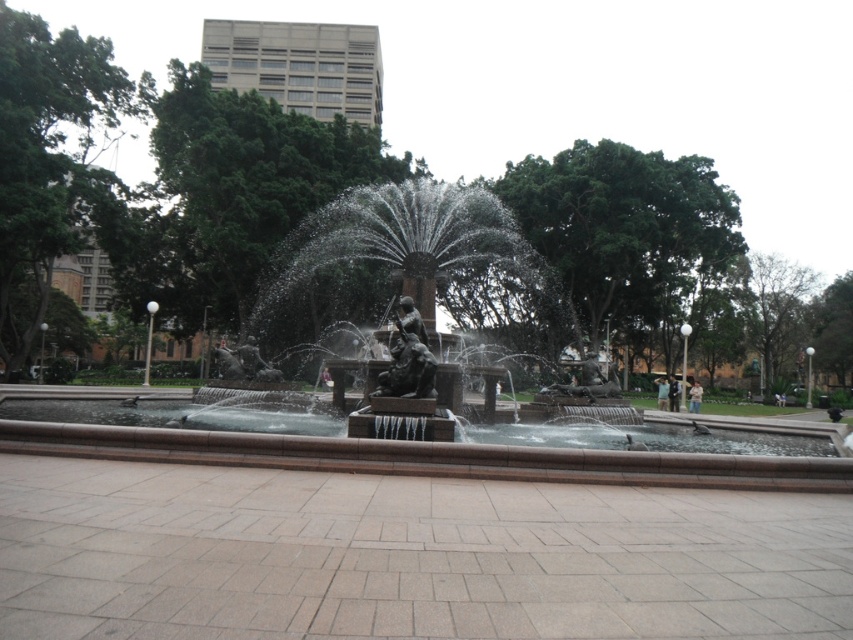
The height and width of the screenshot is (640, 853). What do you see at coordinates (422, 452) in the screenshot?
I see `bronze statue fountain at center` at bounding box center [422, 452].

Between bronze statue fountain at center and bronze statue at center, which one has more height?

bronze statue fountain at center

Between point (380, 426) and point (398, 396), which one is positioned behind?

Positioned behind is point (398, 396).

Where is `bronze statue fountain at center`? bronze statue fountain at center is located at coordinates (422, 452).